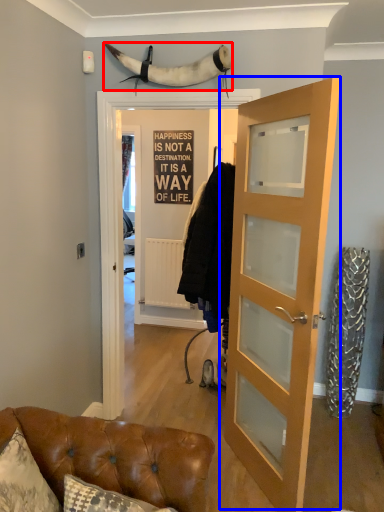
Question: Which object appears farthest to the camera in this image, animal (highlighted by a red box) or door (highlighted by a blue box)?

Choices:
 (A) animal
 (B) door

Answer: (A)